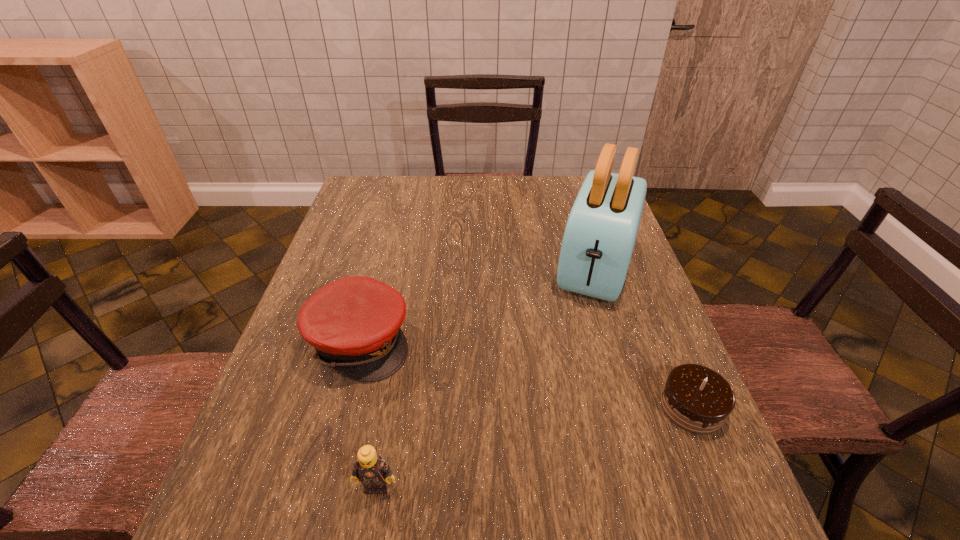
At what (x,y) coordinates should I click in order to perform the action: click on vacant space at the near left corner of the desktop. Please return your answer as a coordinate pair (x, y). Looking at the image, I should click on (287, 485).

Where is `free space between the Lego and the chocolate cake`? free space between the Lego and the chocolate cake is located at coordinates (535, 446).

Find the location of a particular element. The width and height of the screenshot is (960, 540). free area in between the Lego and the toaster is located at coordinates (487, 376).

The height and width of the screenshot is (540, 960). In order to click on unoccupied area between the toaster and the nearest object in this screenshot , I will do `click(487, 376)`.

Find the location of `vacant area that lies between the nearest object and the toaster`. vacant area that lies between the nearest object and the toaster is located at coordinates (487, 376).

The image size is (960, 540). Find the location of `free space that is in between the toaster and the shortest object`. free space that is in between the toaster and the shortest object is located at coordinates (644, 336).

Where is `free spot between the cap and the tallest object`? This screenshot has width=960, height=540. free spot between the cap and the tallest object is located at coordinates (478, 304).

Where is `free space between the cap and the chocolate cake`? This screenshot has width=960, height=540. free space between the cap and the chocolate cake is located at coordinates pyautogui.click(x=526, y=374).

This screenshot has height=540, width=960. I want to click on empty space that is in between the cap and the toaster, so click(x=478, y=304).

Locate an element on the screen. The height and width of the screenshot is (540, 960). vacant region between the Lego and the cap is located at coordinates (369, 414).